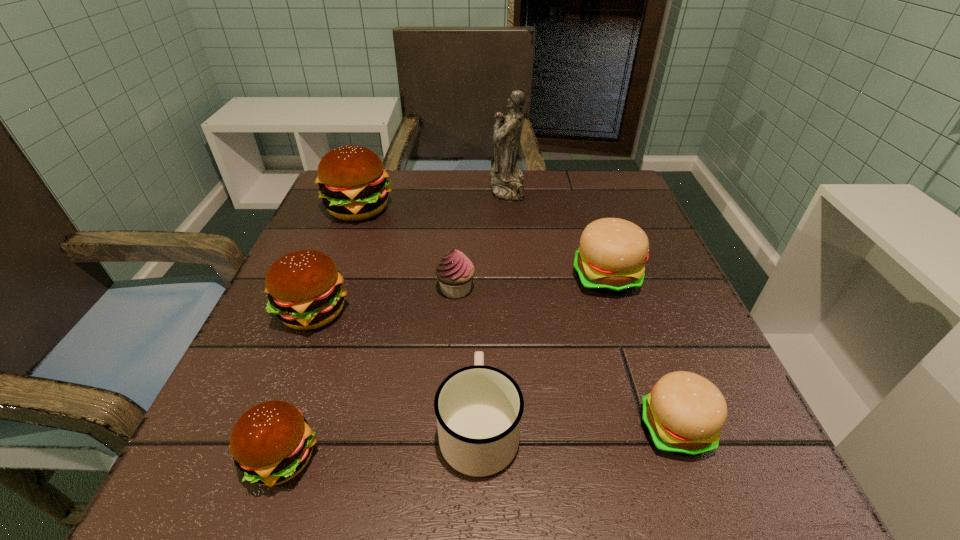
I want to click on vacant position at the right edge of the desktop, so click(x=732, y=427).

Where is `free region at the far right corner of the desktop`? Image resolution: width=960 pixels, height=540 pixels. free region at the far right corner of the desktop is located at coordinates (626, 176).

In the image, there is a desktop. Find the location of `vacant space at the near right corner`. vacant space at the near right corner is located at coordinates (752, 471).

Identify the location of free space between the mug and the tallest object. The image size is (960, 540). (493, 308).

The height and width of the screenshot is (540, 960). What are the coordinates of `free area in between the cupcake and the second tallest object` in the screenshot? It's located at (407, 249).

Where is `empty space between the second nearest brown hamburger and the nearest brown hamburger`? Image resolution: width=960 pixels, height=540 pixels. empty space between the second nearest brown hamburger and the nearest brown hamburger is located at coordinates pos(298,384).

Locate an element on the screen. The height and width of the screenshot is (540, 960). free space that is in between the smallest brown hamburger and the tallest object is located at coordinates (395, 323).

Where is `vacant area that lies between the mug and the pink cupcake`? Image resolution: width=960 pixels, height=540 pixels. vacant area that lies between the mug and the pink cupcake is located at coordinates (468, 358).

Identify the location of free space between the smallest brown hamburger and the pink cupcake. (369, 374).

Identify the location of free space between the nearest brown hamburger and the seventh shortest object. pos(320,334).